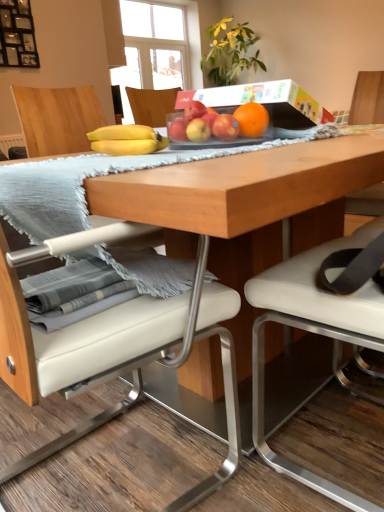
Where is `vacant area that is situated to the right of orange matte at center`? vacant area that is situated to the right of orange matte at center is located at coordinates (291, 131).